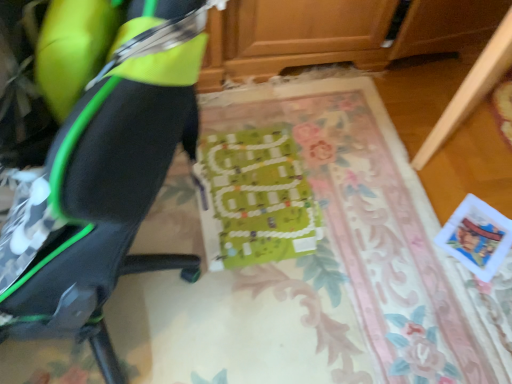
At what (x,y) coordinates should I click in order to perform the action: click on green fabric board at center. Please return your answer as a coordinate pair (x, y). Looking at the image, I should click on (312, 267).

I want to click on wooden drawer at lower right, so click(x=471, y=90).

Between wooden drawer at lower right and matte black chair at left, which one appears on the right side from the viewer's perspective?

wooden drawer at lower right.

Measure the distance between wooden drawer at lower right and matte black chair at left.

The distance of wooden drawer at lower right from matte black chair at left is 4.26 feet.

Based on the photo, is wooden drawer at lower right inside or outside of matte black chair at left?

wooden drawer at lower right exists outside the volume of matte black chair at left.

Between wooden drawer at lower right and green fabric board at center, which one appears on the right side from the viewer's perspective?

wooden drawer at lower right.

In terms of height, does wooden drawer at lower right look taller or shorter compared to green fabric board at center?

Considering their sizes, wooden drawer at lower right has more height than green fabric board at center.

Is wooden drawer at lower right directly adjacent to green fabric board at center?

They are not placed beside each other.

Could you tell me if green fabric board at center is facing wooden drawer at lower right?

Yes, green fabric board at center is facing wooden drawer at lower right.

Which of these two, green fabric board at center or wooden drawer at lower right, is wider?

green fabric board at center.

Which is behind, green fabric board at center or wooden drawer at lower right?

green fabric board at center is more distant.

This screenshot has width=512, height=384. Find the location of `mat below the wooden drawer at lower right (from a real-world perspective)`. mat below the wooden drawer at lower right (from a real-world perspective) is located at coordinates (312, 267).

Where is `furniture that is on the right side of matte black chair at left`? The image size is (512, 384). furniture that is on the right side of matte black chair at left is located at coordinates (471, 90).

Would you consider matte black chair at left to be distant from wooden drawer at lower right?

Yes.

Can you tell me how much matte black chair at left and wooden drawer at lower right differ in facing direction?

96.4 degrees.

Is matte black chair at left facing towards wooden drawer at lower right?

No, matte black chair at left is not facing towards wooden drawer at lower right.

Is matte black chair at left a part of green fabric board at center?

No, matte black chair at left is not a part of green fabric board at center.

Which is behind, green fabric board at center or matte black chair at left?

green fabric board at center.

Between green fabric board at center and matte black chair at left, which one has smaller width?

matte black chair at left.

From a real-world perspective, is matte black chair at left physically located above or below green fabric board at center?

In terms of real-world spatial position, matte black chair at left is above green fabric board at center.

Does matte black chair at left have a larger size compared to green fabric board at center?

Correct, matte black chair at left is larger in size than green fabric board at center.

Is matte black chair at left touching green fabric board at center?

No, matte black chair at left is not making contact with green fabric board at center.

Looking at their sizes, would you say matte black chair at left is wider or thinner than green fabric board at center?

Clearly, matte black chair at left has less width compared to green fabric board at center.

There is a wooden drawer at lower right. Where is `chair above it (from a real-world perspective)`? The height and width of the screenshot is (384, 512). chair above it (from a real-world perspective) is located at coordinates (94, 161).

This screenshot has width=512, height=384. I want to click on furniture in front of the green fabric board at center, so click(471, 90).

Based on the photo, looking at the image, which one is located further to green fabric board at center, wooden drawer at lower right or matte black chair at left?

matte black chair at left is positioned further to the anchor green fabric board at center.

From the image, which object appears to be nearer to wooden drawer at lower right, green fabric board at center or matte black chair at left?

green fabric board at center.

Looking at the image, which one is located further to green fabric board at center, matte black chair at left or wooden drawer at lower right?

matte black chair at left lies further to green fabric board at center than the other object.

Estimate the real-world distances between objects in this image. Which object is closer to matte black chair at left, wooden drawer at lower right or green fabric board at center?

green fabric board at center lies closer to matte black chair at left than the other object.

Based on the photo, considering their positions, is green fabric board at center positioned further to matte black chair at left than wooden drawer at lower right?

wooden drawer at lower right is further to matte black chair at left.

From the picture: Considering their positions, is matte black chair at left positioned further to wooden drawer at lower right than green fabric board at center?

Among the two, matte black chair at left is located further to wooden drawer at lower right.

You are a GUI agent. You are given a task and a screenshot of the screen. Output one action in this format:
    pyautogui.click(x=<x>, y=<y>)
    Task: Click on the mat between matte black chair at left and wooden drawer at lower right from left to right
    
    Given the screenshot: What is the action you would take?
    pyautogui.click(x=312, y=267)